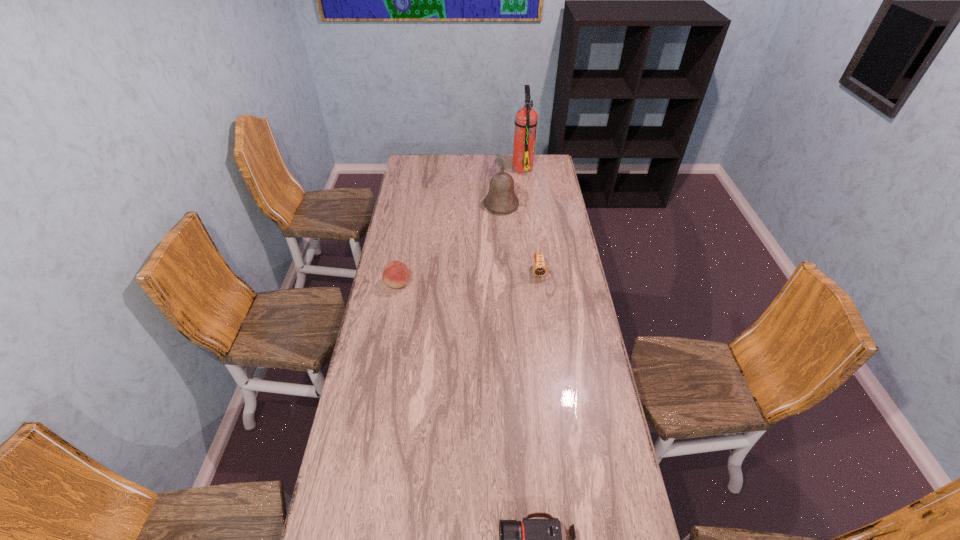
This screenshot has width=960, height=540. Identify the location of free space located 0.260m on the right of the peach. (471, 284).

At what (x,y) coordinates should I click in order to perform the action: click on vacant space situated on the face of the watch. Please return your answer as a coordinate pair (x, y). The width and height of the screenshot is (960, 540). Looking at the image, I should click on (542, 301).

At what (x,y) coordinates should I click in order to perform the action: click on object located in the far edge section of the desktop. Please return your answer as a coordinate pair (x, y). Image resolution: width=960 pixels, height=540 pixels. Looking at the image, I should click on [x=526, y=118].

The height and width of the screenshot is (540, 960). Find the location of `object that is at the left edge`. object that is at the left edge is located at coordinates (395, 274).

At what (x,y) coordinates should I click in order to perform the action: click on fire extinguisher present at the right edge. Please return your answer as a coordinate pair (x, y). Image resolution: width=960 pixels, height=540 pixels. Looking at the image, I should click on (526, 118).

This screenshot has height=540, width=960. I want to click on watch at the right edge, so click(x=539, y=269).

Find the location of a particular element. object present at the far right corner is located at coordinates (526, 118).

At what (x,y) coordinates should I click in order to perform the action: click on vacant space at the far edge. Please return your answer as a coordinate pair (x, y). This screenshot has height=540, width=960. Looking at the image, I should click on (439, 175).

The width and height of the screenshot is (960, 540). In the image, there is a desktop. Find the location of `free region at the left edge`. free region at the left edge is located at coordinates (384, 296).

In the image, there is a desktop. At what (x,y) coordinates should I click in order to perform the action: click on free region at the right edge. Please return your answer as a coordinate pair (x, y). Looking at the image, I should click on (542, 245).